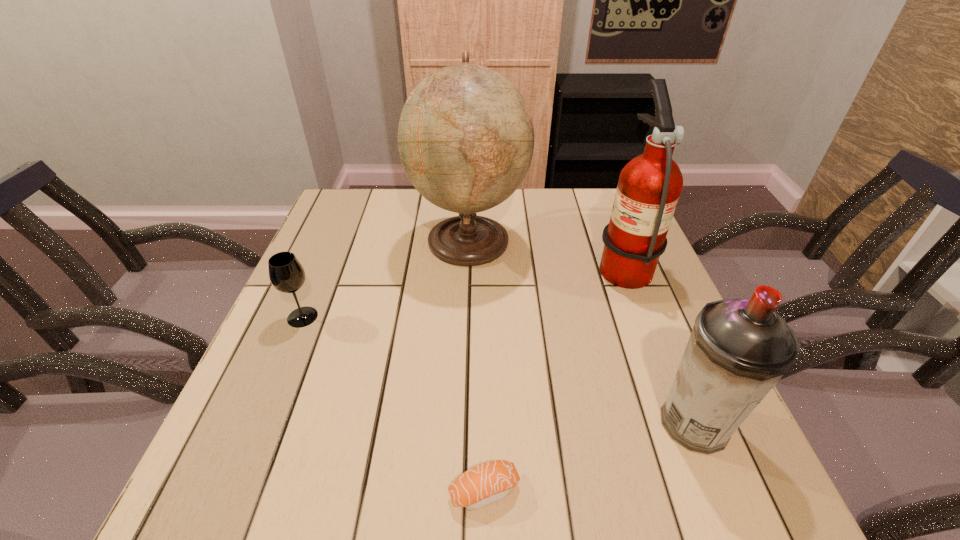
The width and height of the screenshot is (960, 540). Find the location of `vacant space that's between the globe and the leftmost object`. vacant space that's between the globe and the leftmost object is located at coordinates (386, 278).

The width and height of the screenshot is (960, 540). Find the location of `vacant point located between the globe and the fire extinguisher`. vacant point located between the globe and the fire extinguisher is located at coordinates (545, 252).

Where is `free space between the wineglass and the shortest object`? Image resolution: width=960 pixels, height=540 pixels. free space between the wineglass and the shortest object is located at coordinates (394, 404).

I want to click on vacant space in between the fire extinguisher and the third nearest object, so click(463, 291).

Locate an element on the screen. The height and width of the screenshot is (540, 960). free space between the second nearest object and the sushi is located at coordinates (589, 457).

Identify which object is the third nearest to the sushi. Please provide its 2D coordinates. Your answer should be formatted as a tuple, i.e. [(x, y)], where the tuple contains the x and y coordinates of a point satisfying the conditions above.

[(465, 137)]

The width and height of the screenshot is (960, 540). I want to click on object that is the closest to the globe, so click(x=649, y=186).

Identify the location of free location that satisfies the following two spatial constraints: 1. on the nozzle and handle of the fire extinguisher; 2. on the front side of the nearest object. The image size is (960, 540). (709, 491).

The width and height of the screenshot is (960, 540). I want to click on free spot that satisfies the following two spatial constraints: 1. on the nozzle and handle of the fire extinguisher; 2. on the back side of the second nearest object, so click(x=684, y=424).

The image size is (960, 540). Find the location of `vacant space that satisfies the following two spatial constraints: 1. on the front-facing side of the globe; 2. on the left side of the third shortest object`. vacant space that satisfies the following two spatial constraints: 1. on the front-facing side of the globe; 2. on the left side of the third shortest object is located at coordinates (462, 424).